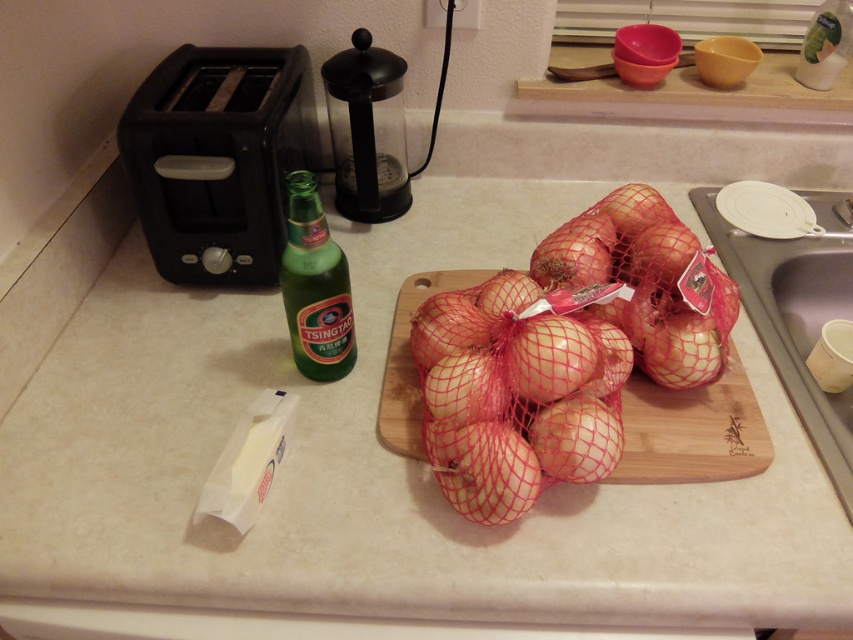
You are organizing the kitchen counter and need to move the black plastic toaster at left closer to the wooden cutting board at center. Which direction should you move the toaster?

The black plastic toaster at left is already positioned on the left side of the wooden cutting board at center, so to move it closer, you should move it to the right towards the cutting board.